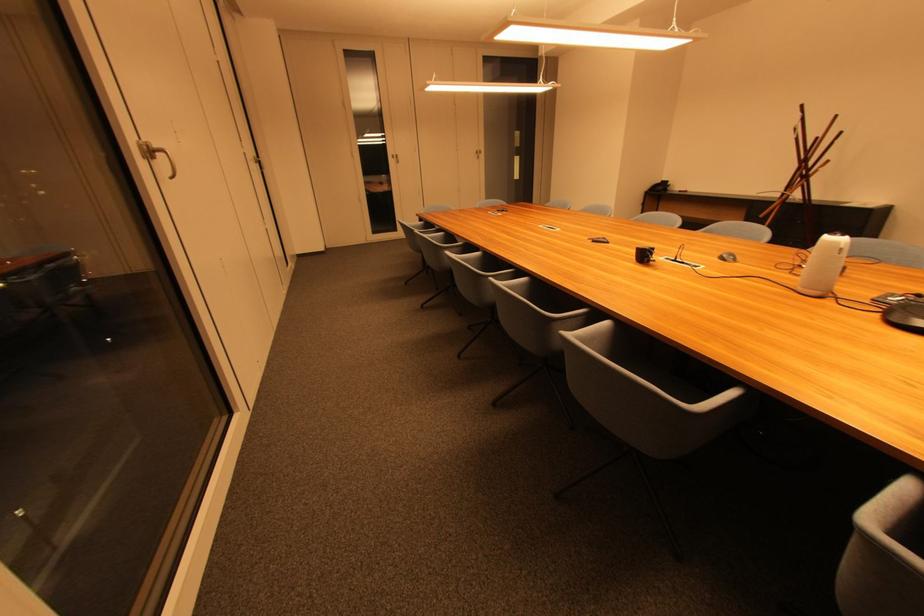
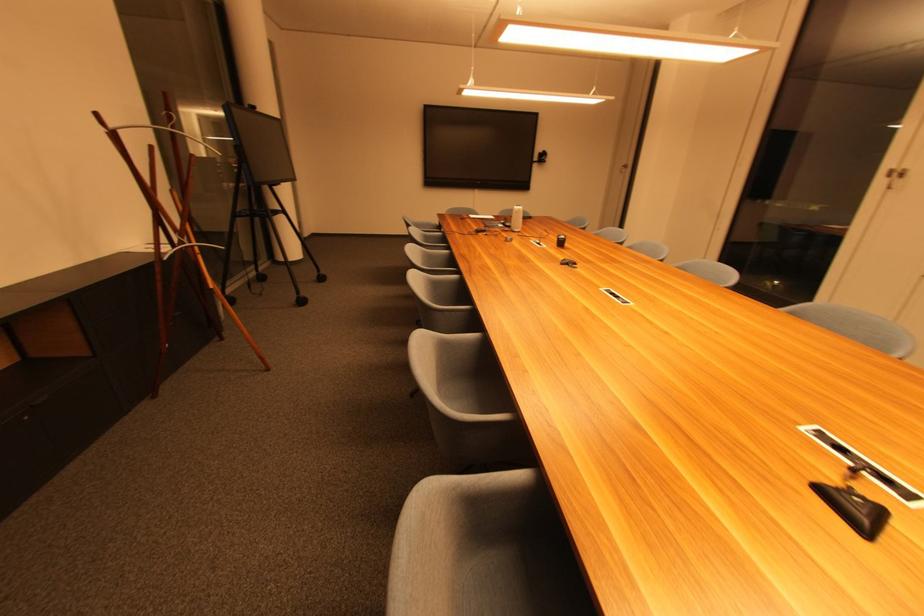
Where in the second image is the point corresponding to the point at 766,217 from the first image?

(216, 288)